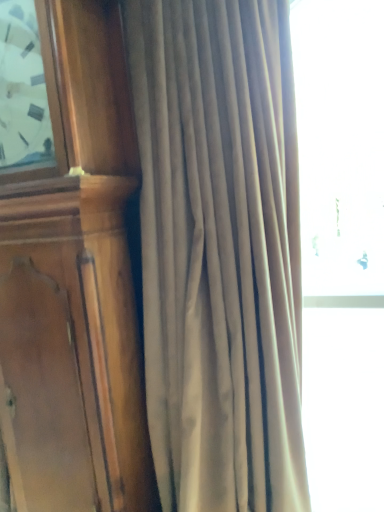
This screenshot has height=512, width=384. Describe the element at coordinates (220, 251) in the screenshot. I see `satin beige curtain at center` at that location.

What is the approximate height of satin beige curtain at center?

satin beige curtain at center is 1.51 meters in height.

Where is `satin beige curtain at center`? The height and width of the screenshot is (512, 384). satin beige curtain at center is located at coordinates (220, 251).

What is the approximate width of wooden clock at left?

wooden clock at left is 13.35 inches wide.

The height and width of the screenshot is (512, 384). Describe the element at coordinates (69, 268) in the screenshot. I see `wooden clock at left` at that location.

The image size is (384, 512). In order to click on wooden clock at left in this screenshot , I will do `click(69, 268)`.

What are the coordinates of `satin beige curtain at center` in the screenshot? It's located at (220, 251).

Based on their positions, is satin beige curtain at center located to the left or right of wooden clock at left?

satin beige curtain at center is positioned on wooden clock at left's right side.

Is the depth of satin beige curtain at center less than that of wooden clock at left?

Yes, satin beige curtain at center is closer to the camera.

Looking at this image, which is closer, (x=286, y=430) or (x=120, y=405)?

Point (x=286, y=430) is positioned farther from the camera compared to point (x=120, y=405).

From the image's perspective, between satin beige curtain at center and wooden clock at left, which one is located above?

wooden clock at left, from the image's perspective.

From a real-world perspective, is satin beige curtain at center physically above wooden clock at left?

No.

Which object is thinner, satin beige curtain at center or wooden clock at left?

With smaller width is wooden clock at left.

Considering the sizes of satin beige curtain at center and wooden clock at left in the image, is satin beige curtain at center taller or shorter than wooden clock at left?

In the image, satin beige curtain at center appears to be shorter than wooden clock at left.

Does satin beige curtain at center have a smaller size compared to wooden clock at left?

Actually, satin beige curtain at center might be larger than wooden clock at left.

Is satin beige curtain at center completely or partially outside of wooden clock at left?

Absolutely, satin beige curtain at center is external to wooden clock at left.

Is satin beige curtain at center directly adjacent to wooden clock at left?

No, satin beige curtain at center is not next to wooden clock at left.

Is satin beige curtain at center oriented towards wooden clock at left?

No, satin beige curtain at center does not turn towards wooden clock at left.

Image resolution: width=384 pixels, height=512 pixels. Identify the location of furniture behind the satin beige curtain at center. (69, 268).

Which object is positioned more to the left, wooden clock at left or satin beige curtain at center?

wooden clock at left is more to the left.

Between wooden clock at left and satin beige curtain at center, which one is positioned in front?

satin beige curtain at center is closer to the camera.

Is point (146, 437) positioned in front of point (173, 99)?

No, (146, 437) is further to viewer.

From the image's perspective, between wooden clock at left and satin beige curtain at center, which one is located above?

From the image's view, wooden clock at left is above.

From a real-world perspective, is wooden clock at left located beneath satin beige curtain at center?

No, from a real-world perspective, wooden clock at left is not beneath satin beige curtain at center.

Between wooden clock at left and satin beige curtain at center, which one has larger width?

Wider between the two is satin beige curtain at center.

Between wooden clock at left and satin beige curtain at center, which one has less height?

Standing shorter between the two is satin beige curtain at center.

In the scene shown: Considering the sizes of objects wooden clock at left and satin beige curtain at center in the image provided, who is smaller, wooden clock at left or satin beige curtain at center?

Smaller between the two is wooden clock at left.

Is wooden clock at left situated inside satin beige curtain at center or outside?

wooden clock at left is not inside satin beige curtain at center, it's outside.

Is wooden clock at left not close to satin beige curtain at center?

No.

Does wooden clock at left turn towards satin beige curtain at center?

No, wooden clock at left is not facing towards satin beige curtain at center.

Identify the location of curtain that is under the wooden clock at left (from a real-world perspective). The width and height of the screenshot is (384, 512). (220, 251).

Where is `curtain below the wooden clock at left (from a real-world perspective)`? The height and width of the screenshot is (512, 384). curtain below the wooden clock at left (from a real-world perspective) is located at coordinates (220, 251).

Locate an element on the screen. The image size is (384, 512). furniture on the left of the satin beige curtain at center is located at coordinates 69,268.